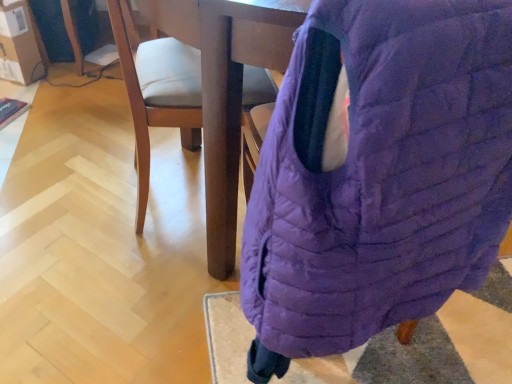
Question: Is purple quilted bean bag chair at center wider or thinner than matte brown cardboard at upper left?

Choices:
 (A) wide
 (B) thin

Answer: (A)

Question: Is purple quilted bean bag chair at center situated inside matte brown cardboard at upper left or outside?

Choices:
 (A) inside
 (B) outside

Answer: (B)

Question: Which of these objects is positioned farthest from the matte brown cardboard at upper left?

Choices:
 (A) light brown wood chair at center
 (B) purple quilted bean bag chair at center

Answer: (B)

Question: Which object is positioned farthest from the purple quilted bean bag chair at center?

Choices:
 (A) light brown wood chair at center
 (B) matte brown cardboard at upper left

Answer: (B)